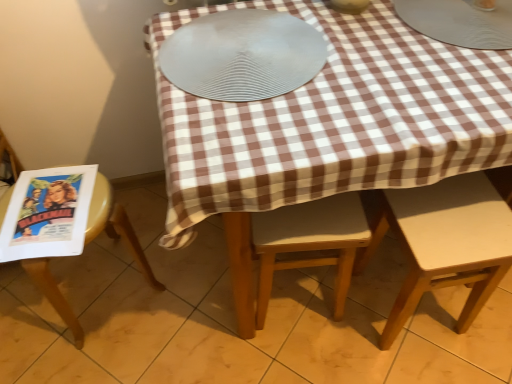
Question: Should I look upward or downward to see matte paper comic book at left?

Choices:
 (A) down
 (B) up

Answer: (A)

Question: Is light brown wooden chair at center, placed as the second chair when sorted from left to right, at the left side of metallic silver plate at upper right, the 2th tableware positioned from the left?

Choices:
 (A) yes
 (B) no

Answer: (A)

Question: Would you say light brown wooden chair at center, placed as the second chair when sorted from left to right, is outside metallic silver plate at upper right, the 2th tableware positioned from the left?

Choices:
 (A) no
 (B) yes

Answer: (B)

Question: Is light brown wooden chair at center, arranged as the second chair when viewed from the right, closer to the viewer compared to metallic silver plate at upper right, the 2th tableware positioned from the left?

Choices:
 (A) yes
 (B) no

Answer: (B)

Question: Does light brown wooden chair at center, placed as the second chair when sorted from left to right, have a greater height compared to metallic silver plate at upper right, the first tableware positioned from the right?

Choices:
 (A) no
 (B) yes

Answer: (B)

Question: Considering the relative sizes of light brown wooden chair at center, arranged as the second chair when viewed from the right, and metallic silver plate at upper right, the first tableware positioned from the right, in the image provided, is light brown wooden chair at center, arranged as the second chair when viewed from the right, bigger than metallic silver plate at upper right, the first tableware positioned from the right,?

Choices:
 (A) yes
 (B) no

Answer: (A)

Question: From a real-world perspective, is light brown wooden chair at center, arranged as the second chair when viewed from the right, on top of metallic silver plate at upper right, the first tableware positioned from the right?

Choices:
 (A) no
 (B) yes

Answer: (A)

Question: Is silver textured platter at center to the right of matte paper comic book at left from the viewer's perspective?

Choices:
 (A) yes
 (B) no

Answer: (A)

Question: Is silver textured platter at center placed right next to matte paper comic book at left?

Choices:
 (A) no
 (B) yes

Answer: (A)

Question: Could matte paper comic book at left be considered to be inside silver textured platter at center?

Choices:
 (A) no
 (B) yes

Answer: (A)

Question: From a real-world perspective, is silver textured platter at center under matte paper comic book at left?

Choices:
 (A) no
 (B) yes

Answer: (A)

Question: Considering the relative sizes of silver textured platter at center and matte paper comic book at left in the image provided, is silver textured platter at center shorter than matte paper comic book at left?

Choices:
 (A) no
 (B) yes

Answer: (B)

Question: Does silver textured platter at center have a greater height compared to matte paper comic book at left?

Choices:
 (A) no
 (B) yes

Answer: (A)

Question: Can you confirm if light brown wooden chair at center, placed as the second chair when sorted from left to right, is taller than silver textured platter at center?

Choices:
 (A) yes
 (B) no

Answer: (A)